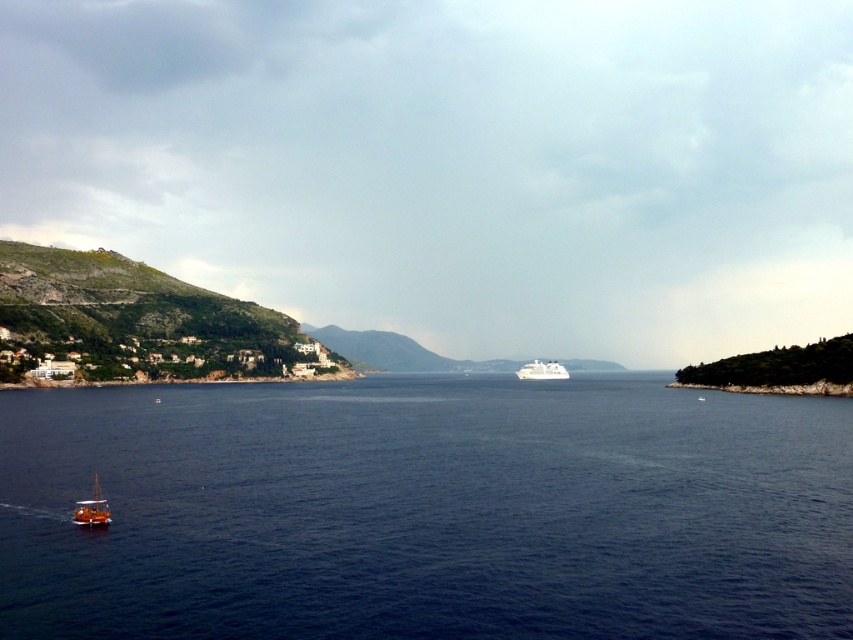
Question: Which point is closer to the camera taking this photo?

Choices:
 (A) (193, 564)
 (B) (523, 365)
 (C) (86, 508)

Answer: (A)

Question: Which point appears closest to the camera in this image?

Choices:
 (A) (541, 605)
 (B) (529, 372)

Answer: (A)

Question: Among these points, which one is nearest to the camera?

Choices:
 (A) (550, 378)
 (B) (515, 634)

Answer: (B)

Question: Is blue water at lower left smaller than wooden sailboat at lower left?

Choices:
 (A) yes
 (B) no

Answer: (B)

Question: Is wooden sailboat at lower left behind white glossy cruise ship at center?

Choices:
 (A) no
 (B) yes

Answer: (A)

Question: Is wooden sailboat at lower left smaller than white glossy cruise ship at center?

Choices:
 (A) yes
 (B) no

Answer: (A)